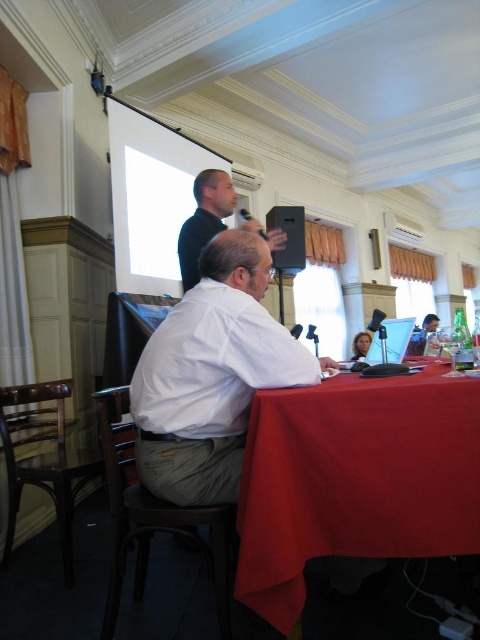
Question: Considering the real-world distances, which object is closest to the white cotton shirt at center?

Choices:
 (A) red cloth table at lower center
 (B) black matte shirt at upper center

Answer: (A)

Question: Based on their relative distances, which object is farther from the white cotton shirt at center?

Choices:
 (A) black matte shirt at upper center
 (B) red cloth table at lower center

Answer: (A)

Question: Which object is farther from the camera taking this photo?

Choices:
 (A) red cloth table at lower center
 (B) white cotton shirt at center
 (C) black matte shirt at upper center

Answer: (C)

Question: Is red cloth table at lower center positioned at the back of white cotton shirt at center?

Choices:
 (A) yes
 (B) no

Answer: (B)

Question: Does red cloth table at lower center have a smaller size compared to black matte shirt at upper center?

Choices:
 (A) no
 (B) yes

Answer: (A)

Question: Is white cotton shirt at center below black matte shirt at upper center?

Choices:
 (A) no
 (B) yes

Answer: (B)